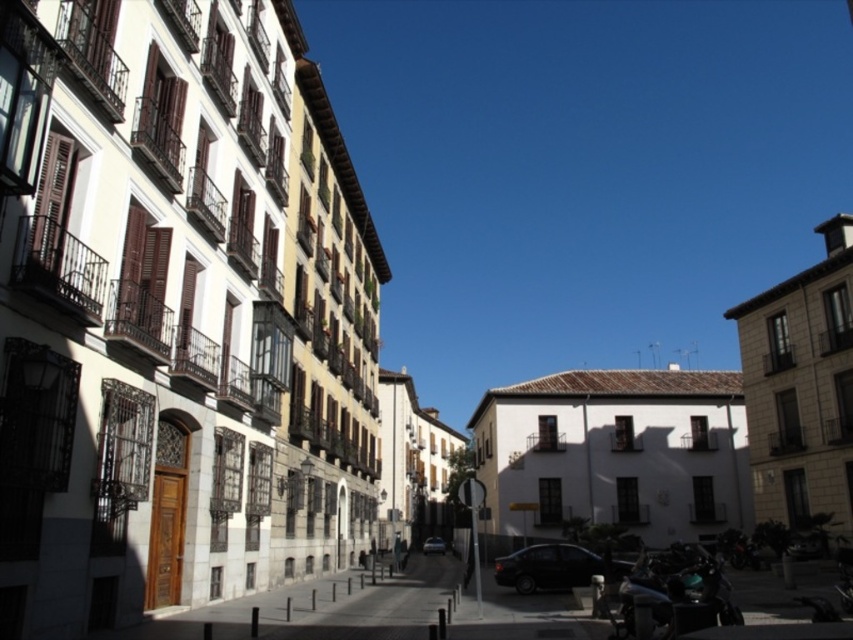
Can you confirm if shiny black motorcycle at lower right is positioned above shiny black sedan at center?

Indeed, shiny black motorcycle at lower right is positioned over shiny black sedan at center.

Is shiny black motorcycle at lower right positioned at the back of shiny black sedan at center?

No, shiny black motorcycle at lower right is closer to the viewer.

Describe the element at coordinates (674, 588) in the screenshot. The height and width of the screenshot is (640, 853). I see `shiny black motorcycle at lower right` at that location.

Where is `shiny black motorcycle at lower right`? The height and width of the screenshot is (640, 853). shiny black motorcycle at lower right is located at coordinates (674, 588).

Which is more to the right, shiny black sedan at center or shiny silver car at center?

Positioned to the right is shiny black sedan at center.

Who is higher up, shiny black sedan at center or shiny silver car at center?

Positioned higher is shiny black sedan at center.

You are a GUI agent. You are given a task and a screenshot of the screen. Output one action in this format:
    pyautogui.click(x=<x>, y=<y>)
    Task: Click on the shiny black sedan at center
    
    Given the screenshot: What is the action you would take?
    pyautogui.click(x=554, y=566)

This screenshot has height=640, width=853. What are the coordinates of `shiny black sedan at center` in the screenshot? It's located at (554, 566).

Measure the distance between shiny black motorcycle at lower right and shiny silver car at center.

109.19 meters

Between shiny black motorcycle at lower right and shiny silver car at center, which one appears on the right side from the viewer's perspective?

shiny black motorcycle at lower right

Based on the photo, who is more distant from viewer, (640, 552) or (427, 540)?

The point (427, 540) is more distant.

In order to click on shiny black motorcycle at lower right in this screenshot , I will do `click(674, 588)`.